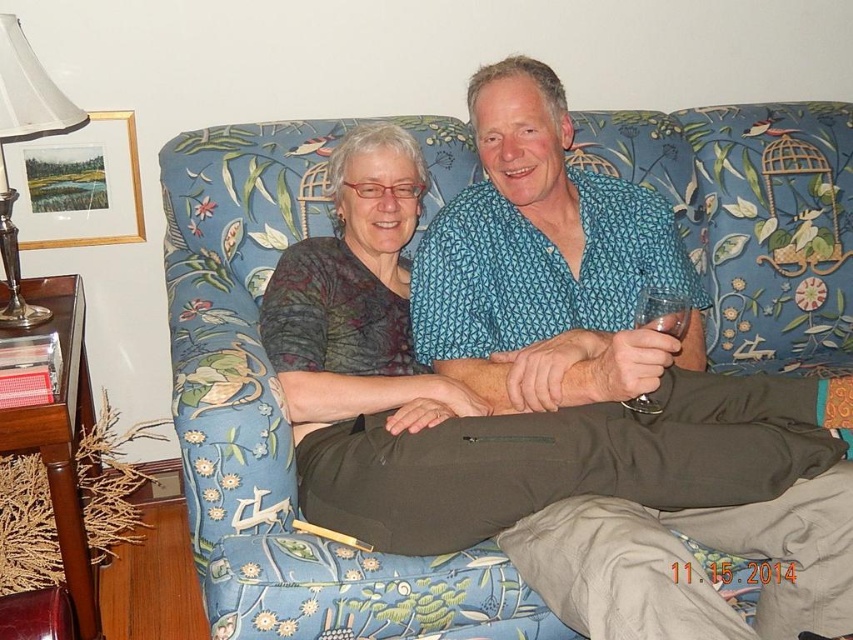
Can you confirm if floral fabric couch at center is wider than blue printed shirt at center?

Yes.

In the scene shown: Is floral fabric couch at center taller than blue printed shirt at center?

Yes, floral fabric couch at center is taller than blue printed shirt at center.

Where is `floral fabric couch at center`? Image resolution: width=853 pixels, height=640 pixels. floral fabric couch at center is located at coordinates (283, 417).

Does point (202, 148) come in front of point (9, 264)?

No, it is not.

The height and width of the screenshot is (640, 853). I want to click on floral fabric couch at center, so click(283, 417).

Is blue printed shirt at center positioned at the back of silver metallic lampshade at upper left?

That is False.

Can you confirm if blue printed shirt at center is wider than silver metallic lampshade at upper left?

Correct, the width of blue printed shirt at center exceeds that of silver metallic lampshade at upper left.

Which is in front, point (434, 326) or point (9, 108)?

Point (9, 108)

This screenshot has width=853, height=640. What are the coordinates of `blue printed shirt at center` in the screenshot? It's located at (544, 262).